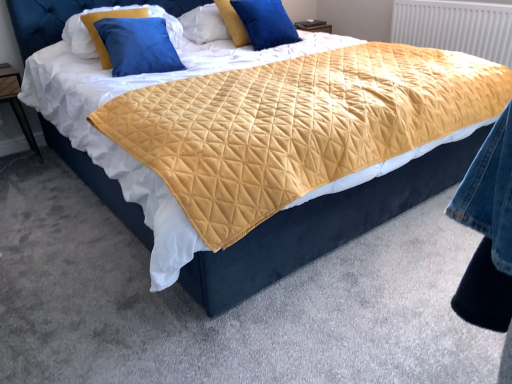
Question: Which direction should I rotate to look at yellow quilted pillow at upper center, which ranks as the 2th pillow in left-to-right order, — up or down?

Choices:
 (A) up
 (B) down

Answer: (A)

Question: Is wooden nightstand at left far from yellow quilted radiator at upper right?

Choices:
 (A) yes
 (B) no

Answer: (A)

Question: Considering the relative sizes of wooden nightstand at left and yellow quilted radiator at upper right in the image provided, is wooden nightstand at left shorter than yellow quilted radiator at upper right?

Choices:
 (A) yes
 (B) no

Answer: (A)

Question: Is the surface of wooden nightstand at left in direct contact with yellow quilted radiator at upper right?

Choices:
 (A) no
 (B) yes

Answer: (A)

Question: Can you confirm if wooden nightstand at left is smaller than yellow quilted radiator at upper right?

Choices:
 (A) yes
 (B) no

Answer: (A)

Question: From a real-world perspective, is wooden nightstand at left positioned over yellow quilted radiator at upper right based on gravity?

Choices:
 (A) no
 (B) yes

Answer: (A)

Question: Is wooden nightstand at left located outside yellow quilted radiator at upper right?

Choices:
 (A) no
 (B) yes

Answer: (B)

Question: Considering the relative sizes of yellow quilted radiator at upper right and yellow quilted pillow at upper center, the first pillow from the right, in the image provided, is yellow quilted radiator at upper right smaller than yellow quilted pillow at upper center, the first pillow from the right,?

Choices:
 (A) no
 (B) yes

Answer: (A)

Question: Does yellow quilted radiator at upper right have a larger size compared to yellow quilted pillow at upper center, which ranks as the 2th pillow in left-to-right order?

Choices:
 (A) no
 (B) yes

Answer: (B)

Question: Does yellow quilted radiator at upper right appear on the right side of yellow quilted pillow at upper center, which ranks as the 2th pillow in left-to-right order?

Choices:
 (A) yes
 (B) no

Answer: (A)

Question: From the image's perspective, is yellow quilted radiator at upper right below yellow quilted pillow at upper center, which ranks as the 2th pillow in left-to-right order?

Choices:
 (A) no
 (B) yes

Answer: (B)

Question: Is yellow quilted pillow at upper center, which ranks as the 2th pillow in left-to-right order, completely or partially inside yellow quilted radiator at upper right?

Choices:
 (A) yes
 (B) no

Answer: (B)

Question: Is yellow quilted radiator at upper right not within yellow quilted pillow at upper center, the first pillow from the right?

Choices:
 (A) no
 (B) yes

Answer: (B)

Question: Considering the relative positions of blue velvet pillow at upper left, arranged as the first pillow when viewed from the left, and wooden nightstand at left in the image provided, is blue velvet pillow at upper left, arranged as the first pillow when viewed from the left, behind wooden nightstand at left?

Choices:
 (A) no
 (B) yes

Answer: (A)